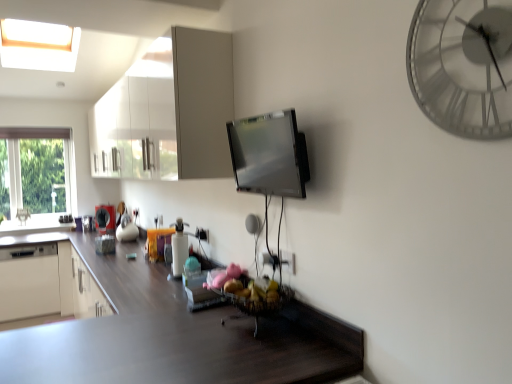
Question: From the image's perspective, relative to white glossy cabinet at upper center, is metallic silver clock at upper right above or below?

Choices:
 (A) above
 (B) below

Answer: (B)

Question: Is metallic silver clock at upper right situated inside white glossy cabinet at upper center or outside?

Choices:
 (A) outside
 (B) inside

Answer: (A)

Question: Which object is the farthest from the white glossy bottle at center, which appears as the 3th appliance when viewed from the top?

Choices:
 (A) metallic silver clock at upper right
 (B) transparent glass window at left
 (C) satin silver tv at center, the 4th appliance when ordered from bottom to top
 (D) white glossy cabinet at upper center
 (E) dark wood countertop at lower center

Answer: (B)

Question: Which is nearer to the dark wood countertop at lower center?

Choices:
 (A) white glossy dishwasher at lower left, positioned as the fourth appliance in right-to-left order
 (B) white glossy bottle at center, placed as the third appliance when sorted from back to front
 (C) white glossy cabinet at upper center
 (D) transparent glass window at left
 (E) satin silver tv at center, the 4th appliance when ordered from bottom to top

Answer: (B)